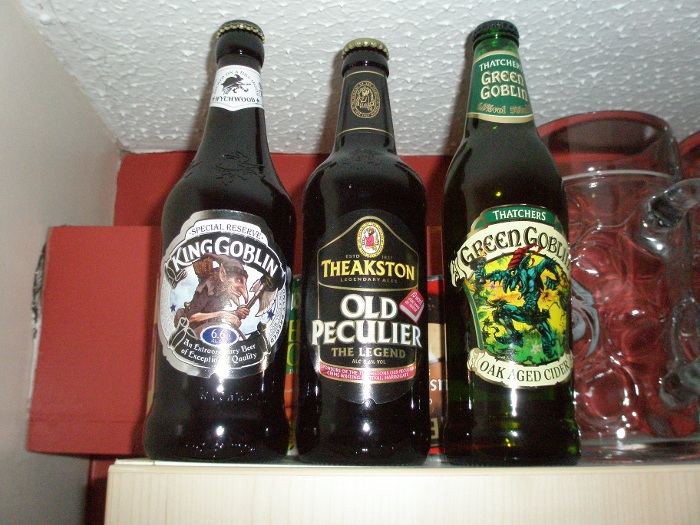
Identify the location of red painted wall. (102, 345), (139, 196), (85, 478).